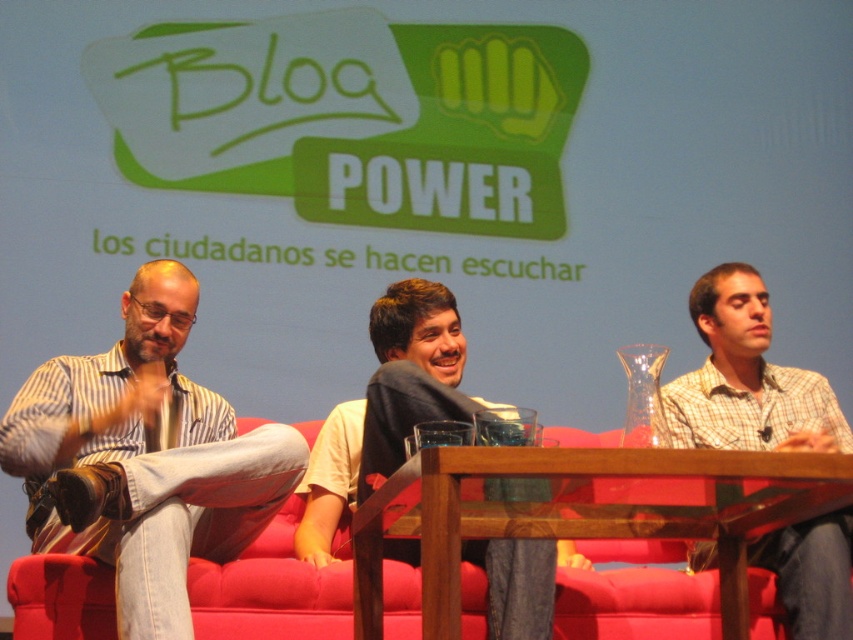
Based on the photo, is plaid shirt at center closer to camera compared to light brown shirt at center?

Yes.

Can you confirm if plaid shirt at center is taller than light brown shirt at center?

Yes.

Who is more distant from viewer, (747,321) or (432,310)?

→ Point (747,321)

The width and height of the screenshot is (853, 640). What are the coordinates of `plaid shirt at center` in the screenshot? It's located at (747, 378).

Is transparent glass table at center shorter than light brown shirt at center?

Incorrect, transparent glass table at center's height does not fall short of light brown shirt at center's.

Between transparent glass table at center and light brown shirt at center, which one appears on the right side from the viewer's perspective?

Positioned to the right is transparent glass table at center.

Identify the location of transparent glass table at center. The image size is (853, 640). (585, 513).

Is striped cotton shirt at left shorter than light brown shirt at center?

In fact, striped cotton shirt at left may be taller than light brown shirt at center.

Can you confirm if striped cotton shirt at left is bigger than light brown shirt at center?

Yes.

What are the coordinates of `striped cotton shirt at left` in the screenshot? It's located at (144, 460).

This screenshot has width=853, height=640. In order to click on striped cotton shirt at left in this screenshot , I will do `click(144, 460)`.